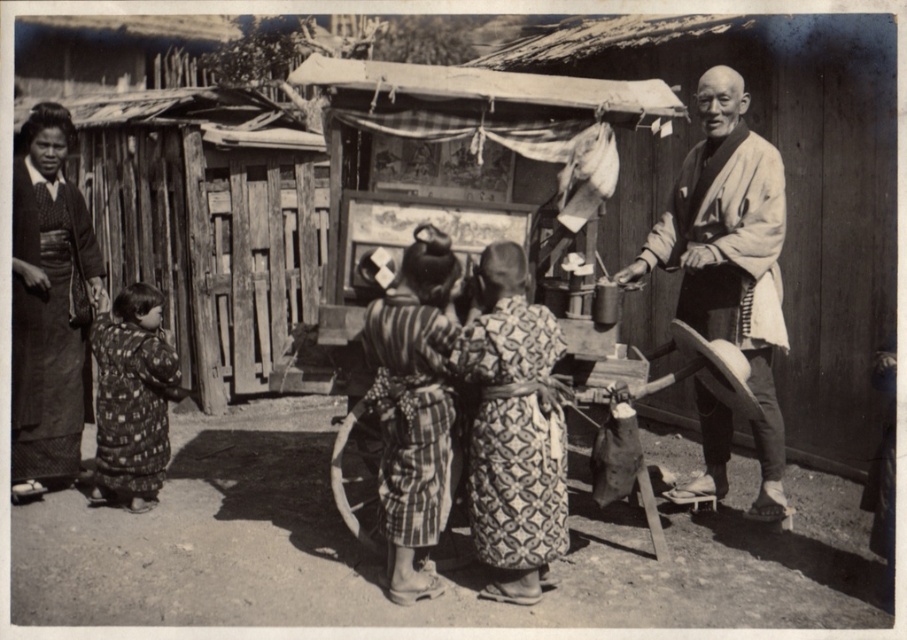
You are a tailor observing two garments in the image. The dark fabric kimono at left and the printed fabric dress at left. Which garment has a larger size?

The dark fabric kimono at left has a larger size compared to the printed fabric dress at left.

You are an anthropologist studying traditional clothing in rural East Asia. You observe two kimonos in the scene described. Which kimono is taller when comparing the white cotton kimono at right and the patterned fabric kimono at center?

The white cotton kimono at right is taller than the patterned fabric kimono at center according to the description provided.